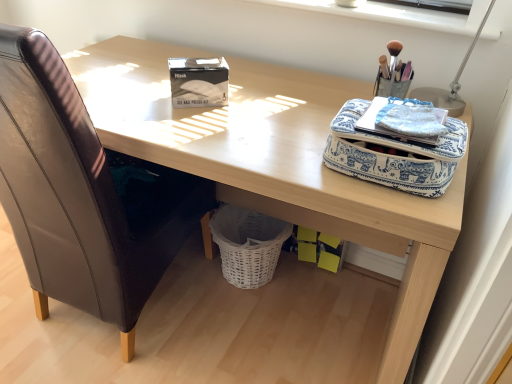
Image resolution: width=512 pixels, height=384 pixels. In order to click on vacant space positioned to the left of white matte gel nail polish kit at upper center in this screenshot , I will do `click(133, 95)`.